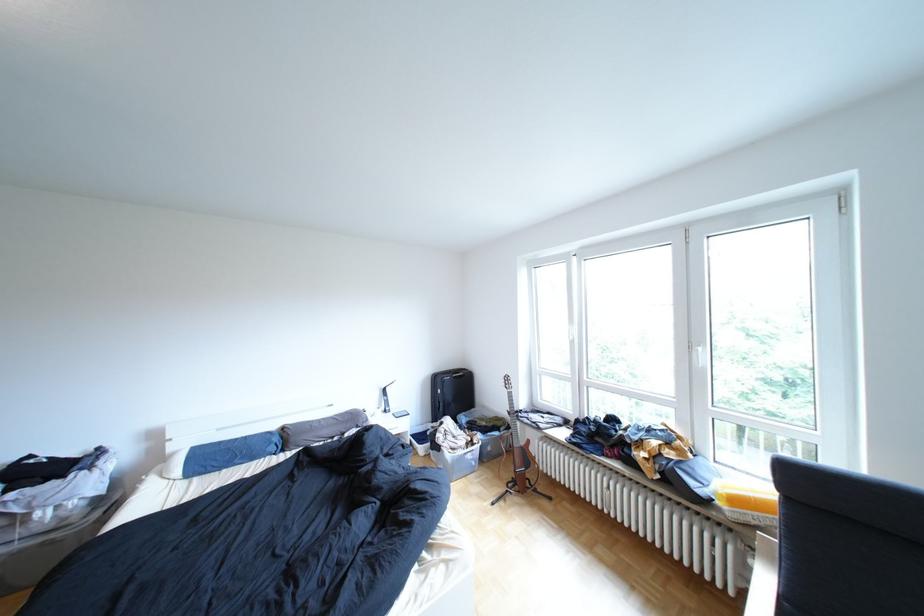
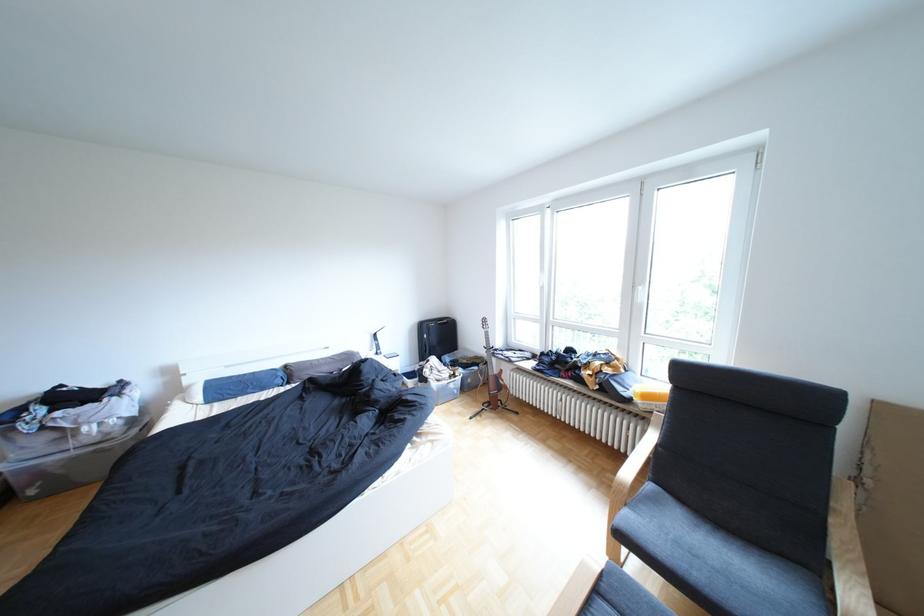
Question: The first image is from the beginning of the video and the second image is from the end. How did the camera likely rotate when shooting the video?

Choices:
 (A) Left
 (B) Right
 (C) Up
 (D) Down

Answer: (D)